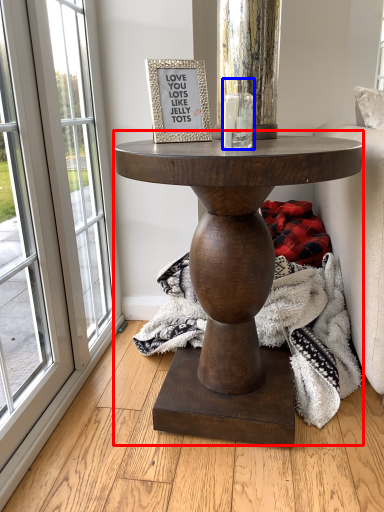
Question: Which of the following is the farthest to the observer, table (highlighted by a red box) or candle holder (highlighted by a blue box)?

Choices:
 (A) table
 (B) candle holder

Answer: (B)